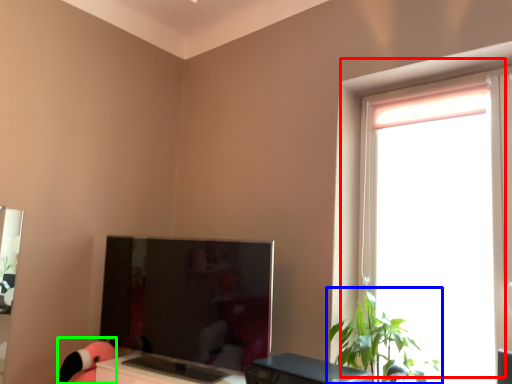
Question: Which object is the closest to the window (highlighted by a red box)? Choose among these: houseplant (highlighted by a blue box) or toy (highlighted by a green box).

Choices:
 (A) houseplant
 (B) toy

Answer: (A)